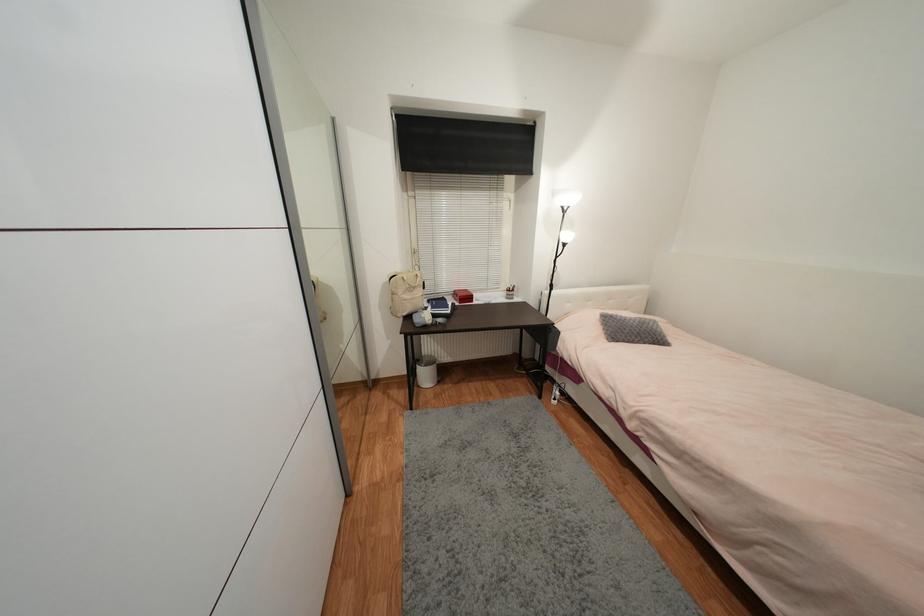
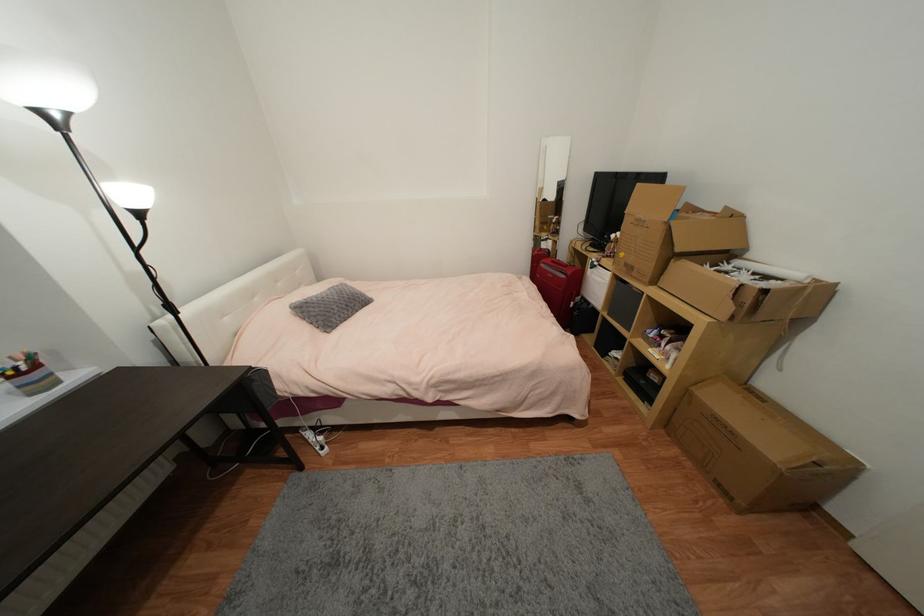
Based on the continuous images, in which direction is the camera rotating?

The rotation direction of the camera is right-down.